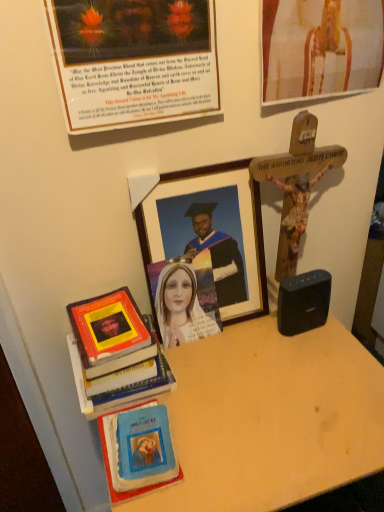
Where is `vacant area on the back side of blue matte book at center, which is the 1th book in bottom-to-top order`? The image size is (384, 512). vacant area on the back side of blue matte book at center, which is the 1th book in bottom-to-top order is located at coordinates coord(191,378).